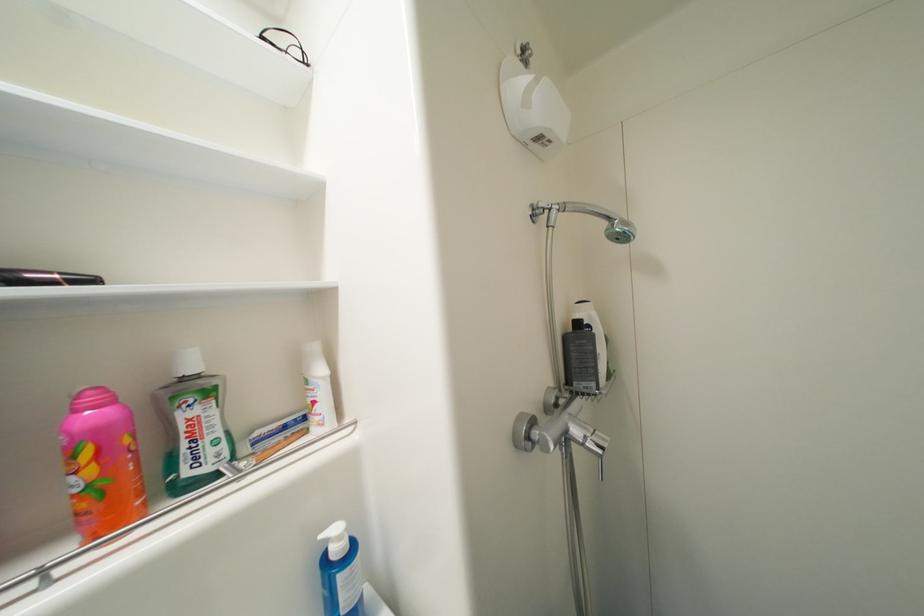
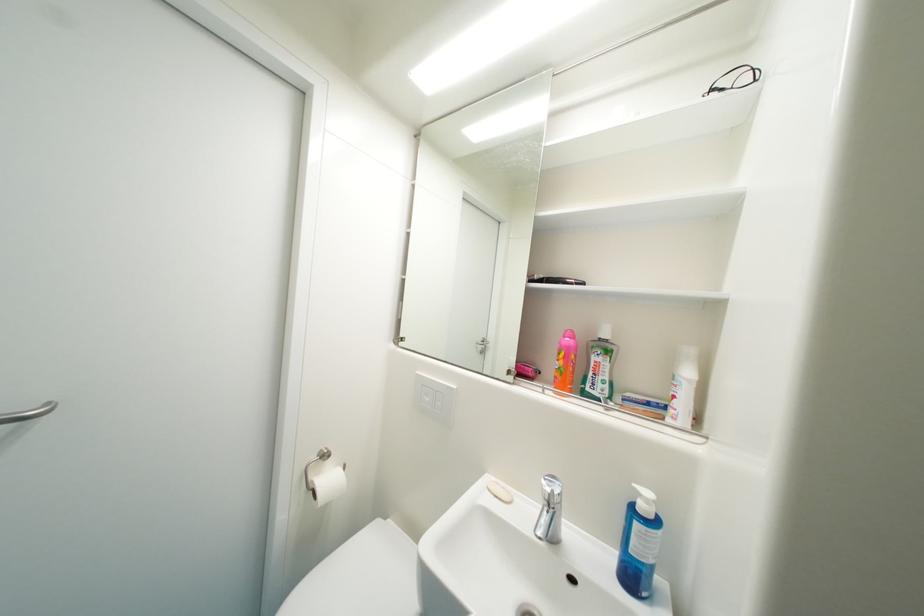
Where in the second image is the point corresponding to point (190, 447) from the first image?

(598, 376)